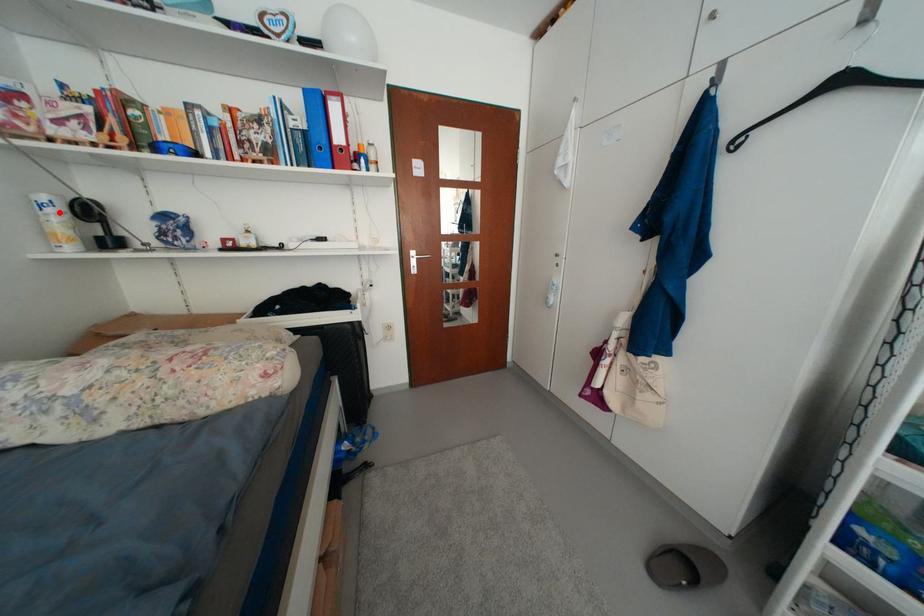
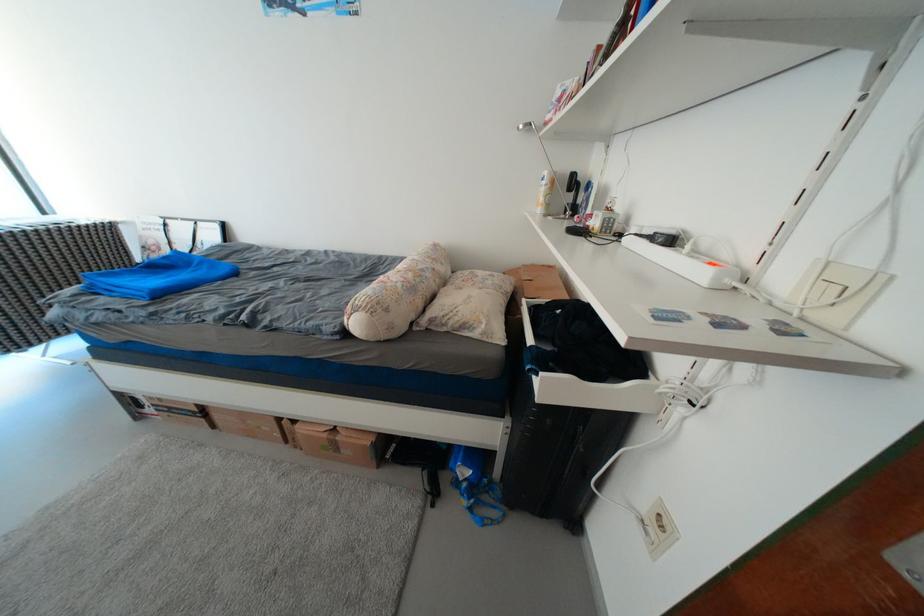
In the second image, find the point that corresponds to the highlighted location in the first image.

(553, 185)